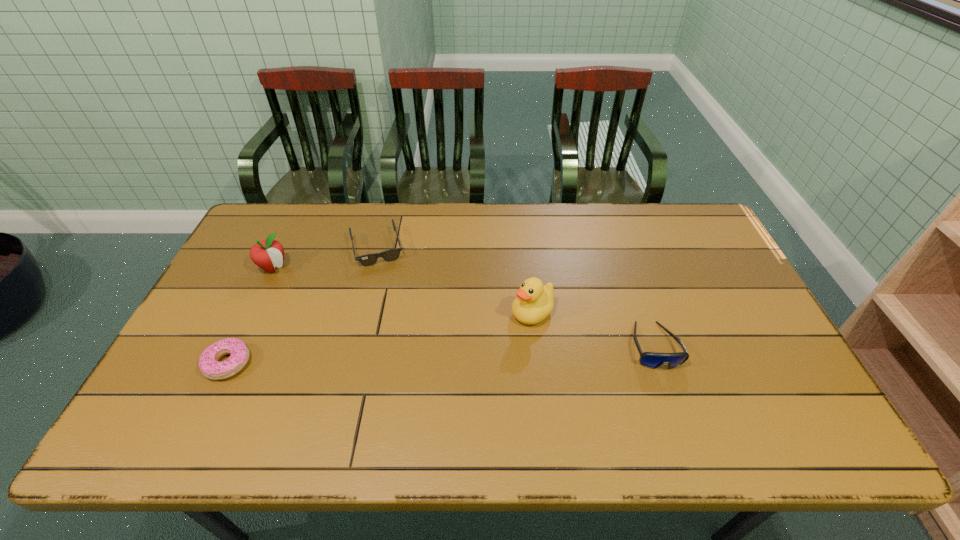
At what (x,y) coordinates should I click in order to perform the action: click on free region located on the side where a bite is taken out of the second tallest object. Please return your answer as a coordinate pair (x, y). The image size is (960, 540). Looking at the image, I should click on (349, 327).

Locate an element on the screen. This screenshot has width=960, height=540. blank space located 0.240m on the side where a bite is taken out of the second tallest object is located at coordinates (330, 311).

Locate an element on the screen. free space located 0.130m on the temples of the left sunglasses is located at coordinates (388, 297).

Find the location of a particular element. This screenshot has height=540, width=960. free region located 0.400m on the temples of the left sunglasses is located at coordinates (406, 372).

This screenshot has height=540, width=960. I want to click on free space located 0.170m on the temples of the left sunglasses, so click(x=391, y=307).

Image resolution: width=960 pixels, height=540 pixels. I want to click on free space located at the beak of the second object from right to left, so click(x=477, y=349).

This screenshot has height=540, width=960. I want to click on free location located 0.190m at the beak of the second object from right to left, so click(x=463, y=359).

Identify the location of vacant space situated 0.290m at the beak of the second object from right to left. (431, 380).

The height and width of the screenshot is (540, 960). I want to click on object present at the far edge, so click(389, 255).

The width and height of the screenshot is (960, 540). Find the location of `object positioned at the near edge`. object positioned at the near edge is located at coordinates (209, 364).